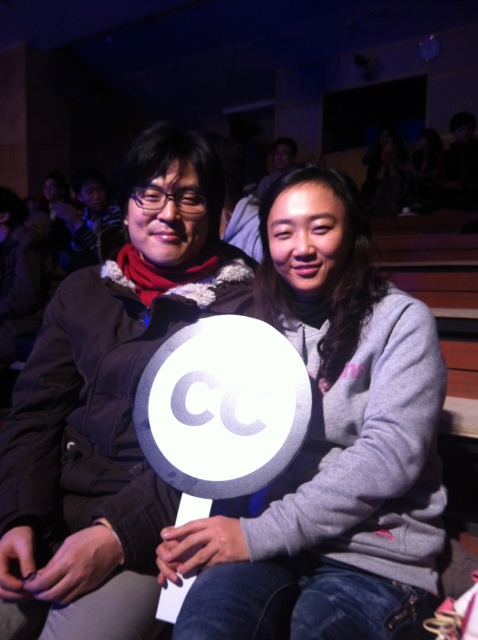
Can you confirm if gray fleece sweatshirt at center is positioned to the left of dark gray fleece jacket at center?

In fact, gray fleece sweatshirt at center is to the right of dark gray fleece jacket at center.

Which is more to the left, gray fleece sweatshirt at center or dark gray fleece jacket at center?

Positioned to the left is dark gray fleece jacket at center.

Between point (212, 595) and point (10, 499), which one is positioned in front?

Point (212, 595) is more forward.

This screenshot has height=640, width=478. What are the coordinates of `gray fleece sweatshirt at center` in the screenshot? It's located at (329, 448).

Is point (274, 289) closer to viewer compared to point (280, 355)?

That is False.

Can you confirm if gray fleece sweatshirt at center is wider than white plastic sign at center?

Correct, the width of gray fleece sweatshirt at center exceeds that of white plastic sign at center.

Is point (305, 326) farther from camera compared to point (159, 417)?

Yes, it is behind point (159, 417).

The height and width of the screenshot is (640, 478). Identify the location of gray fleece sweatshirt at center. (329, 448).

What do you see at coordinates (108, 404) in the screenshot?
I see `dark gray fleece jacket at center` at bounding box center [108, 404].

Is dark gray fleece jacket at center smaller than white plastic sign at center?

Actually, dark gray fleece jacket at center might be larger than white plastic sign at center.

Measure the distance between dark gray fleece jacket at center and camera.

A distance of 34.28 inches exists between dark gray fleece jacket at center and camera.

Locate an element on the screen. Image resolution: width=478 pixels, height=640 pixels. dark gray fleece jacket at center is located at coordinates (108, 404).